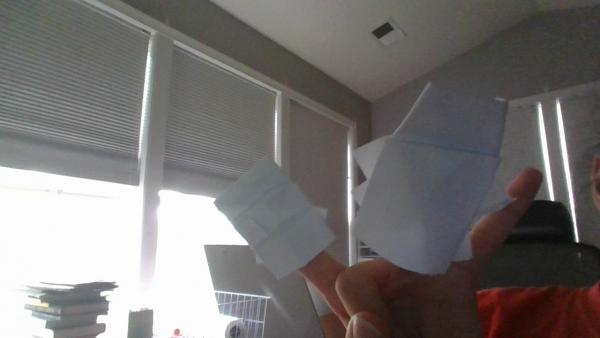
Find the location of a particular element. The height and width of the screenshot is (338, 600). chair is located at coordinates (538, 218).